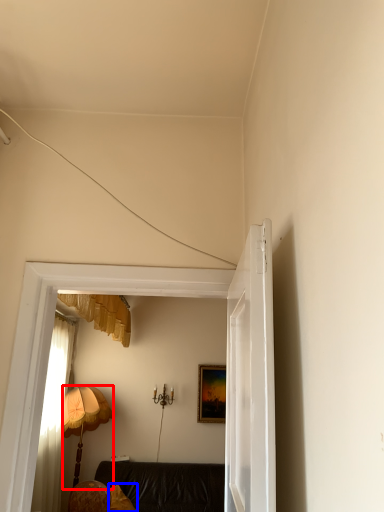
Question: Which object appears farthest to the camera in this image, lamp (highlighted by a red box) or pillow (highlighted by a blue box)?

Choices:
 (A) lamp
 (B) pillow

Answer: (A)